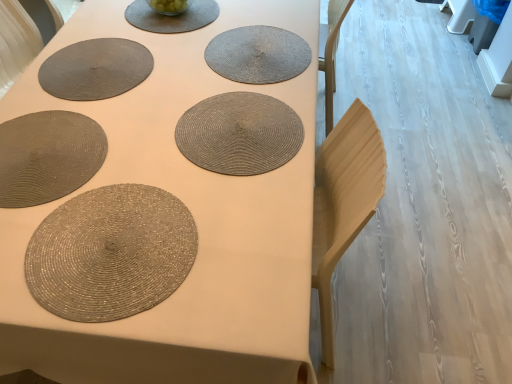
At what (x,y) coordinates should I click in order to perform the action: click on vacant region in front of rattan placemat at lower left, acting as the 2th paper plate starting from the back. Please return your answer as a coordinate pair (x, y). Image resolution: width=512 pixels, height=384 pixels. Looking at the image, I should click on (52, 251).